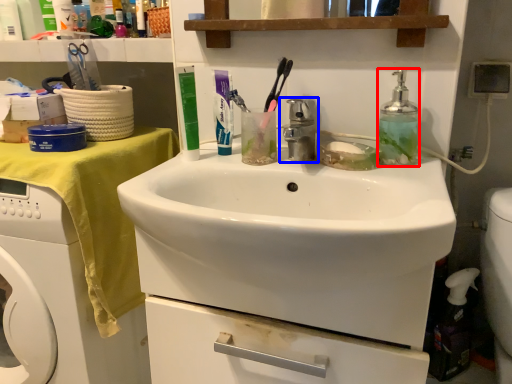
Question: Among these objects, which one is farthest to the camera, bottle (highlighted by a red box) or tap (highlighted by a blue box)?

Choices:
 (A) bottle
 (B) tap

Answer: (A)